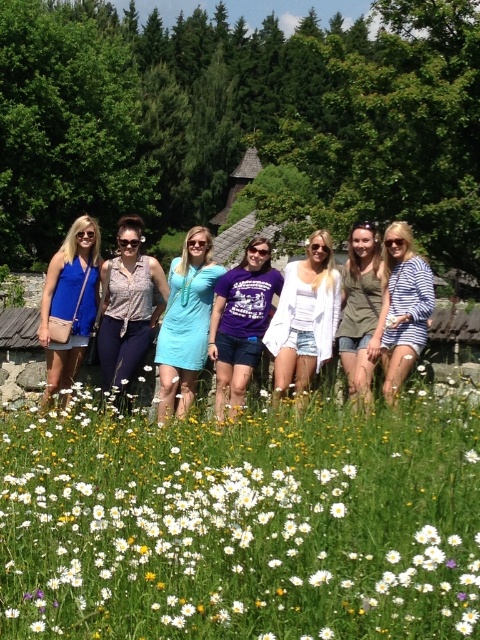
Is point (142, 234) less distant than point (355, 252)?

That is False.

In the scene shown: Is matte pink blouse at center to the left of matte olive green shirt at center from the viewer's perspective?

Correct, you'll find matte pink blouse at center to the left of matte olive green shirt at center.

Between point (136, 333) and point (369, 273), which one is positioned in front?

Positioned in front is point (369, 273).

What are the coordinates of `matte pink blouse at center` in the screenshot? It's located at (128, 305).

Looking at this image, measure the distance from matte blue dress at center to matte pink blouse at center.

The distance of matte blue dress at center from matte pink blouse at center is 56.20 centimeters.

Is matte blue dress at center taller than matte pink blouse at center?

Correct, matte blue dress at center is much taller as matte pink blouse at center.

Measure the distance between matte blue dress at center and camera.

matte blue dress at center and camera are 9.33 meters apart from each other.

Locate an element on the screen. Image resolution: width=480 pixels, height=640 pixels. matte blue dress at center is located at coordinates (186, 323).

Does green grass at lower center appear under striped cotton shirt at center?

Yes, green grass at lower center is below striped cotton shirt at center.

Which of these two, green grass at lower center or striped cotton shirt at center, stands taller?

striped cotton shirt at center is taller.

Who is more forward, (x=227, y=499) or (x=427, y=268)?

Point (x=227, y=499) is more forward.

This screenshot has height=640, width=480. I want to click on green grass at lower center, so click(240, 524).